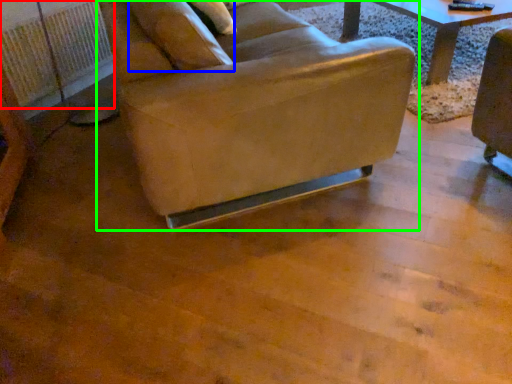
Question: Based on their relative distances, which object is farther from radiator (highlighted by a red box)? Choose from pillow (highlighted by a blue box) and chair (highlighted by a green box).

Choices:
 (A) pillow
 (B) chair

Answer: (A)